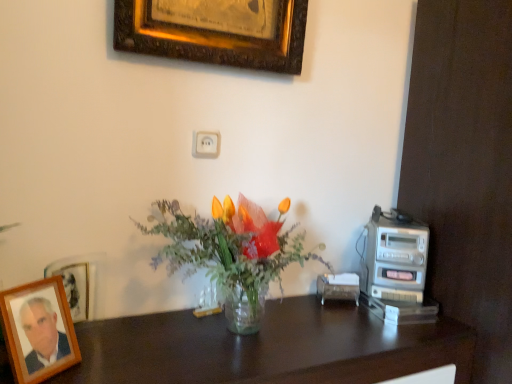
Question: Does gold-framed picture at upper center, the first picture frame viewed from the back, turn towards dark wood desk at center?

Choices:
 (A) no
 (B) yes

Answer: (A)

Question: Are gold-framed picture at upper center, the first picture frame in the top-to-bottom sequence, and dark wood desk at center far apart?

Choices:
 (A) no
 (B) yes

Answer: (A)

Question: Is gold-framed picture at upper center, which appears as the second picture frame when viewed from the left, wider than dark wood desk at center?

Choices:
 (A) yes
 (B) no

Answer: (B)

Question: Can you confirm if gold-framed picture at upper center, the first picture frame viewed from the back, is taller than dark wood desk at center?

Choices:
 (A) no
 (B) yes

Answer: (A)

Question: From the image's perspective, does gold-framed picture at upper center, the first picture frame positioned from the right, appear lower than dark wood desk at center?

Choices:
 (A) no
 (B) yes

Answer: (A)

Question: Does point (161, 208) appear closer or farther from the camera than point (286, 24)?

Choices:
 (A) closer
 (B) farther

Answer: (A)

Question: Is transparent glass vase at center spatially inside gold-framed picture at upper center, which is counted as the 2th picture frame, starting from the bottom, or outside of it?

Choices:
 (A) inside
 (B) outside

Answer: (B)

Question: Would you say transparent glass vase at center is to the left or to the right of gold-framed picture at upper center, which appears as the second picture frame when viewed from the left, in the picture?

Choices:
 (A) right
 (B) left

Answer: (A)

Question: From the image's perspective, is transparent glass vase at center above or below gold-framed picture at upper center, the first picture frame positioned from the right?

Choices:
 (A) above
 (B) below

Answer: (B)

Question: Is gold-framed picture at upper center, which appears as the second picture frame when viewed from the left, bigger or smaller than silver metallic stereo at right?

Choices:
 (A) big
 (B) small

Answer: (A)

Question: Is gold-framed picture at upper center, which appears as the second picture frame when viewed from the left, situated inside silver metallic stereo at right or outside?

Choices:
 (A) inside
 (B) outside

Answer: (B)

Question: Looking at their shapes, would you say gold-framed picture at upper center, the first picture frame in the top-to-bottom sequence, is wider or thinner than silver metallic stereo at right?

Choices:
 (A) wide
 (B) thin

Answer: (B)

Question: From a real-world perspective, is gold-framed picture at upper center, which ranks as the second picture frame in front-to-back order, above or below silver metallic stereo at right?

Choices:
 (A) above
 (B) below

Answer: (A)

Question: Considering the positions of dark wood desk at center and transparent glass vase at center in the image, is dark wood desk at center bigger or smaller than transparent glass vase at center?

Choices:
 (A) small
 (B) big

Answer: (B)

Question: In terms of height, does dark wood desk at center look taller or shorter compared to transparent glass vase at center?

Choices:
 (A) short
 (B) tall

Answer: (B)